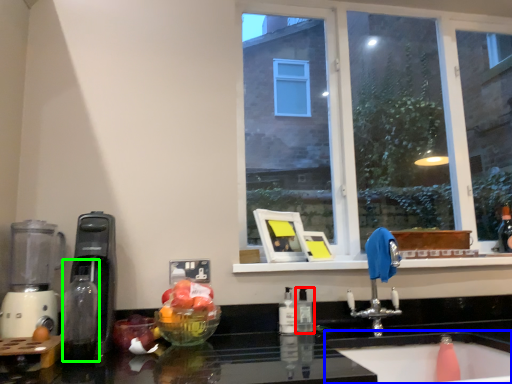
Question: Which is farther away from bottle (highlighted by a red box)? sink (highlighted by a blue box) or bottle (highlighted by a green box)?

Choices:
 (A) sink
 (B) bottle

Answer: (B)